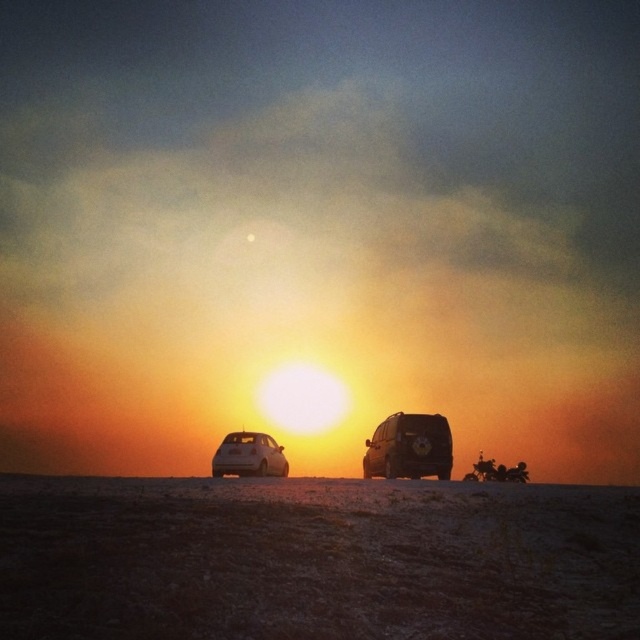
Question: Is shiny black suv at center below white matte hatchback at lower left?

Choices:
 (A) yes
 (B) no

Answer: (B)

Question: Does shiny black suv at center have a smaller size compared to white matte hatchback at lower left?

Choices:
 (A) yes
 (B) no

Answer: (A)

Question: Which point is closer to the camera?

Choices:
 (A) white matte hatchback at lower left
 (B) shiny black suv at center

Answer: (B)

Question: Among these objects, which one is farthest from the camera?

Choices:
 (A) shiny black suv at center
 (B) white matte hatchback at lower left

Answer: (B)

Question: Is shiny black suv at center wider than white matte hatchback at lower left?

Choices:
 (A) no
 (B) yes

Answer: (A)